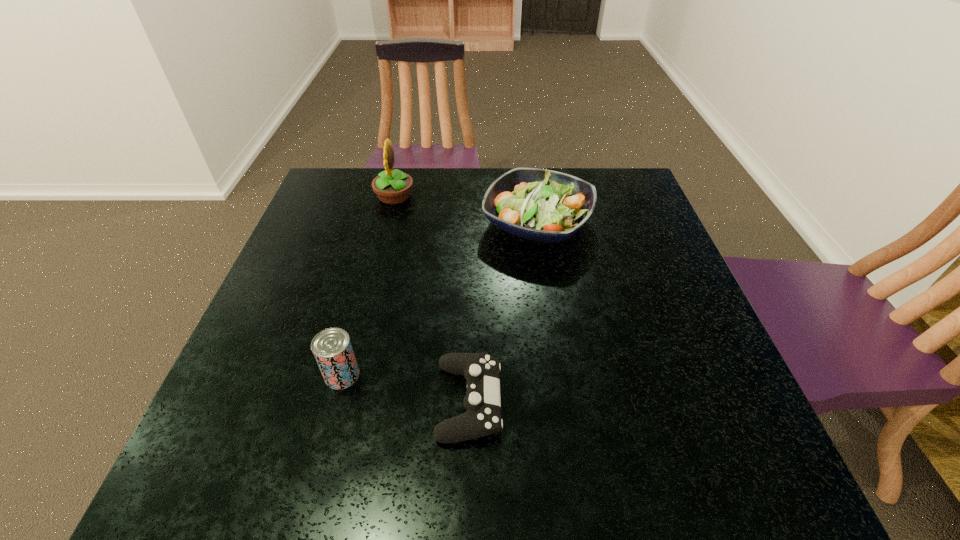
Locate an element on the screen. Image resolution: width=960 pixels, height=540 pixels. the tallest object is located at coordinates (393, 187).

You are a GUI agent. You are given a task and a screenshot of the screen. Output one action in this format:
    pyautogui.click(x=<x>, y=<y>)
    Task: Click on the salad plate
    Image resolution: width=960 pixels, height=540 pixels.
    Given the screenshot: What is the action you would take?
    pyautogui.click(x=542, y=205)

Identify the location of beer can. Image resolution: width=960 pixels, height=540 pixels. (332, 348).

Identify the location of control. The height and width of the screenshot is (540, 960). (482, 400).

What are the coordinates of `vacant point located 0.360m on the face of the tallest object` in the screenshot? It's located at (537, 197).

The width and height of the screenshot is (960, 540). What are the coordinates of `blank area located on the right of the salad plate` in the screenshot? It's located at (614, 224).

Locate an element on the screen. vacant area situated 0.120m on the right of the beer can is located at coordinates (421, 375).

The height and width of the screenshot is (540, 960). I want to click on vacant space located 0.050m on the surface of the control, so click(x=528, y=401).

Identify the location of sunflower located in the far edge section of the desktop. (x=393, y=187).

You are a GUI agent. You are given a task and a screenshot of the screen. Output one action in this format:
    pyautogui.click(x=<x>, y=<y>)
    Task: Click on the salad plate situated at the far edge
    
    Given the screenshot: What is the action you would take?
    pyautogui.click(x=542, y=205)